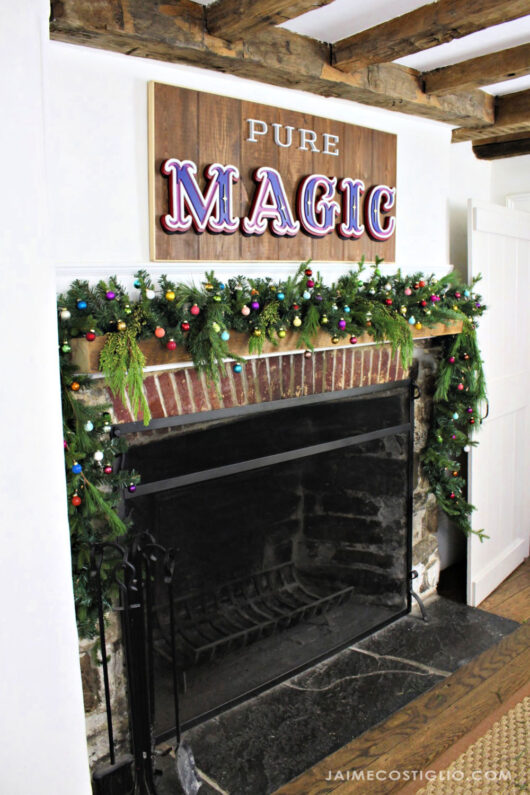
Locate an element on the screen. The width and height of the screenshot is (530, 795). this is the rack to hold the fireplace tools is located at coordinates (146, 576).